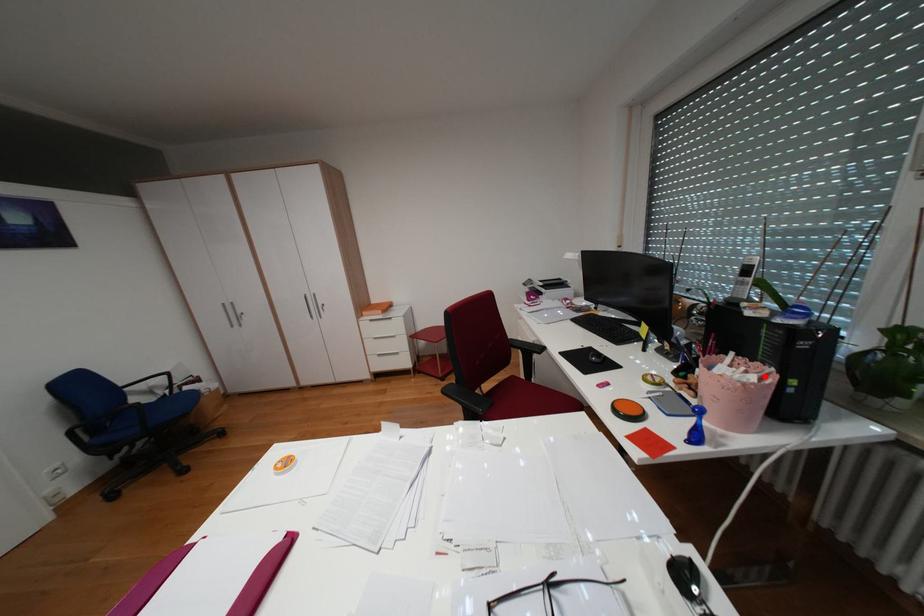
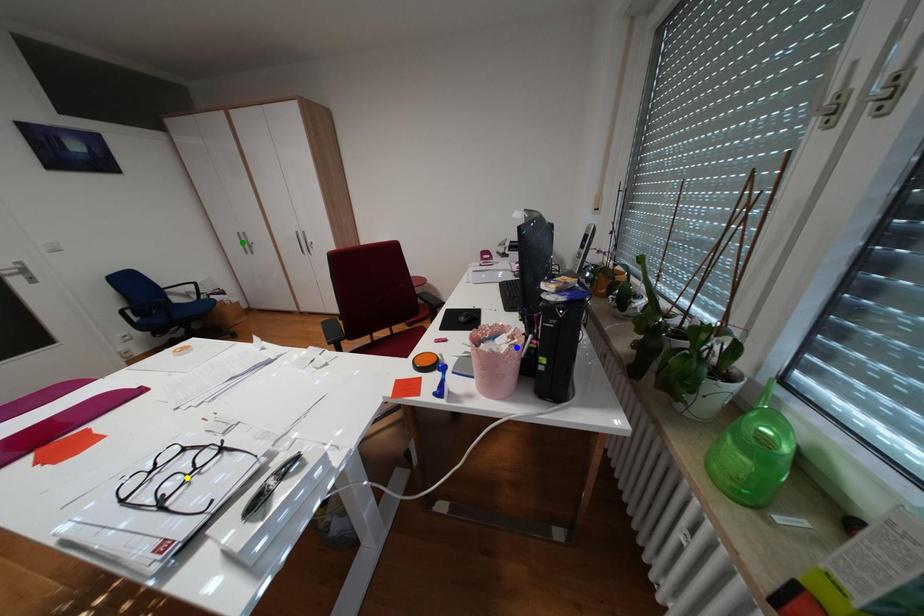
Question: I am providing you with two images of the same scene from different viewpoints. A red point is marked on the first image. You are given multiple points on the second image. Which point in image 2 represents the same 3d spot as the red point in image 1?

Choices:
 (A) blue point
 (B) yellow point
 (C) green point

Answer: (A)